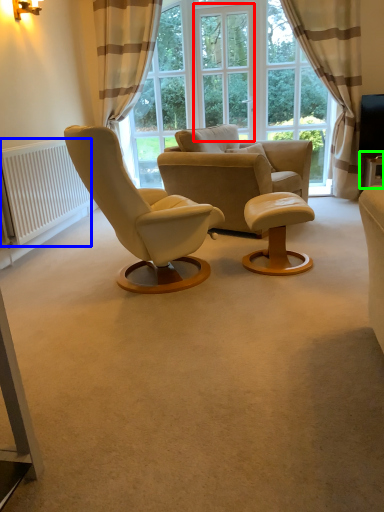
Question: Which object is the closest to the window screen (highlighted by a red box)? Choose among these: radiator (highlighted by a blue box) or round table (highlighted by a green box).

Choices:
 (A) radiator
 (B) round table

Answer: (B)